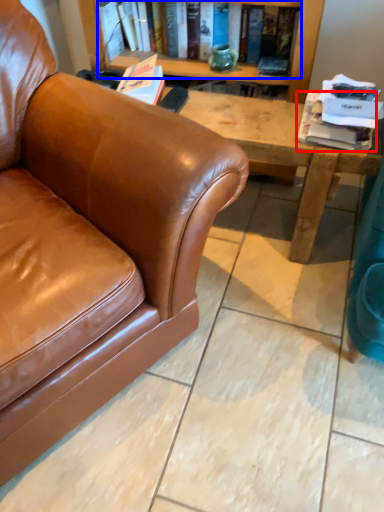
Question: Which of the following is the farthest to the observer, book (highlighted by a red box) or book (highlighted by a blue box)?

Choices:
 (A) book
 (B) book

Answer: (B)